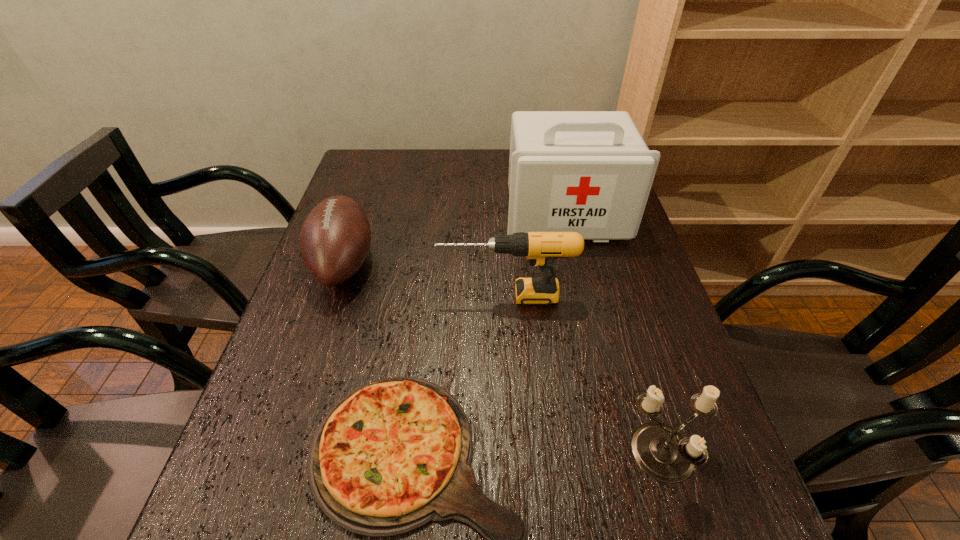
Find the location of a particular element. The width and height of the screenshot is (960, 540). object located in the left edge section of the desktop is located at coordinates (335, 239).

The image size is (960, 540). Find the location of `the first-aid kit that is at the right edge`. the first-aid kit that is at the right edge is located at coordinates (590, 172).

Where is `candle holder at the right edge`? The height and width of the screenshot is (540, 960). candle holder at the right edge is located at coordinates pos(665,454).

This screenshot has height=540, width=960. In the image, there is a desktop. In order to click on vacant space at the far edge in this screenshot , I will do `click(488, 180)`.

You are a GUI agent. You are given a task and a screenshot of the screen. Output one action in this format:
    pyautogui.click(x=<x>, y=<y>)
    Task: Click on the blank space at the near edge of the desktop
    The height and width of the screenshot is (540, 960).
    Given the screenshot: What is the action you would take?
    pyautogui.click(x=529, y=530)

Image resolution: width=960 pixels, height=540 pixels. In the image, there is a desktop. In order to click on free region at the left edge in this screenshot , I will do `click(204, 521)`.

Image resolution: width=960 pixels, height=540 pixels. In the image, there is a desktop. Identify the location of vacant area at the right edge. (607, 267).

This screenshot has width=960, height=540. I want to click on vacant region at the far left corner of the desktop, so click(x=372, y=151).

Locate an element on the screen. The width and height of the screenshot is (960, 540). empty location between the football (American) and the candle holder is located at coordinates (504, 360).

At what (x,y) coordinates should I click in order to perform the action: click on unoccupied area between the football (American) and the first-aid kit. Please return your answer as a coordinate pair (x, y). This screenshot has width=960, height=540. Looking at the image, I should click on (455, 239).